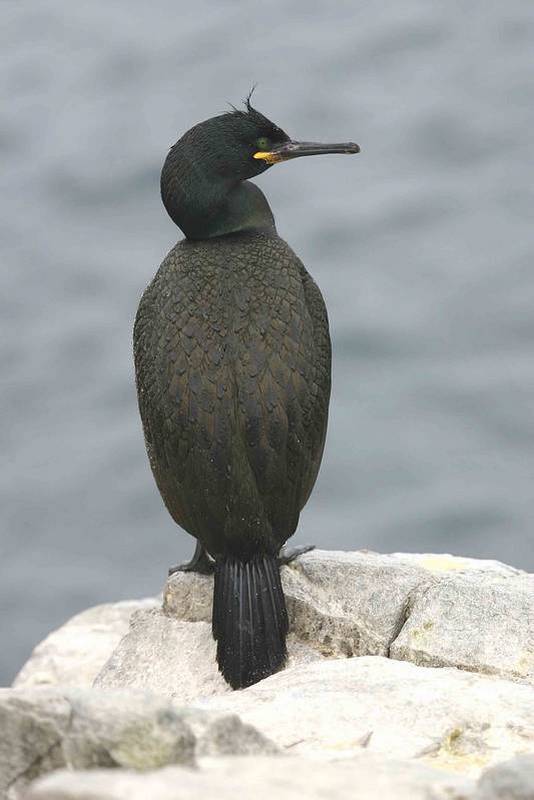
This screenshot has width=534, height=800. Find the location of `ornamental feathers`. ornamental feathers is located at coordinates tap(250, 120).